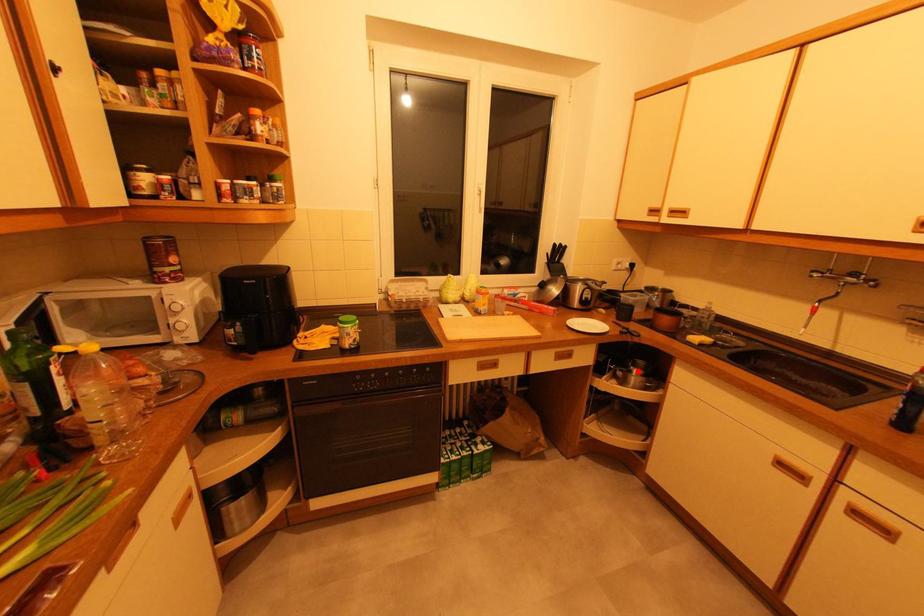
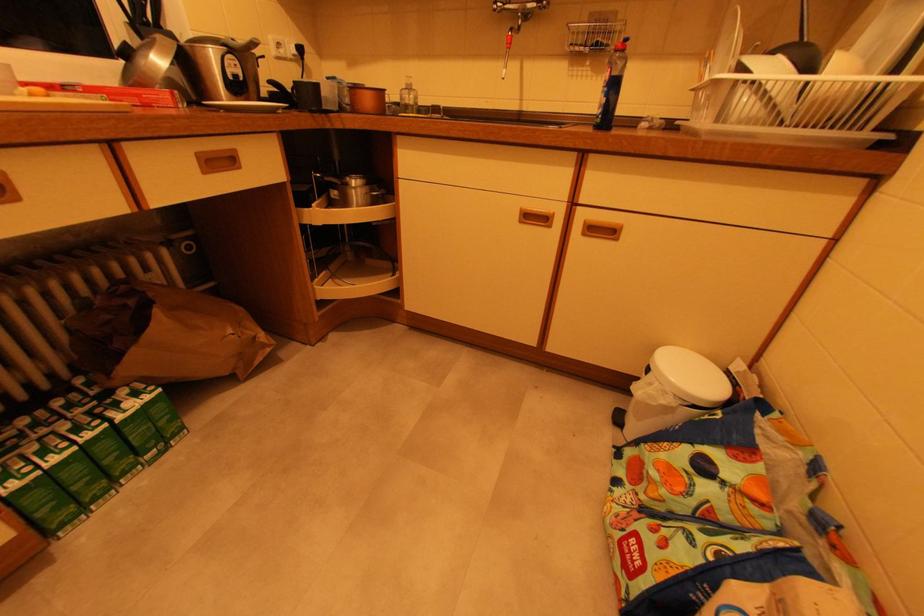
Locate, in the second image, the point that corresponds to the highlighted location in the first image.

(355, 185)